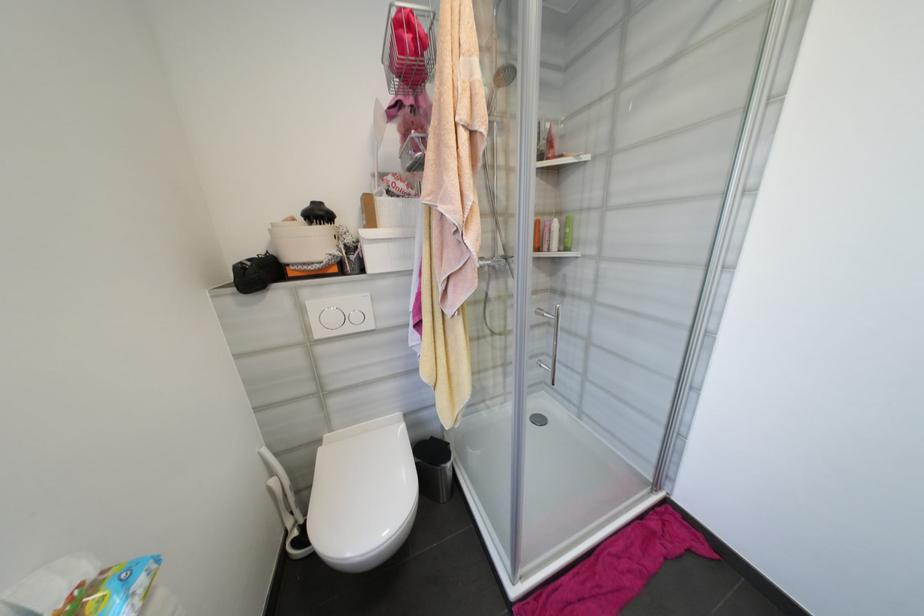
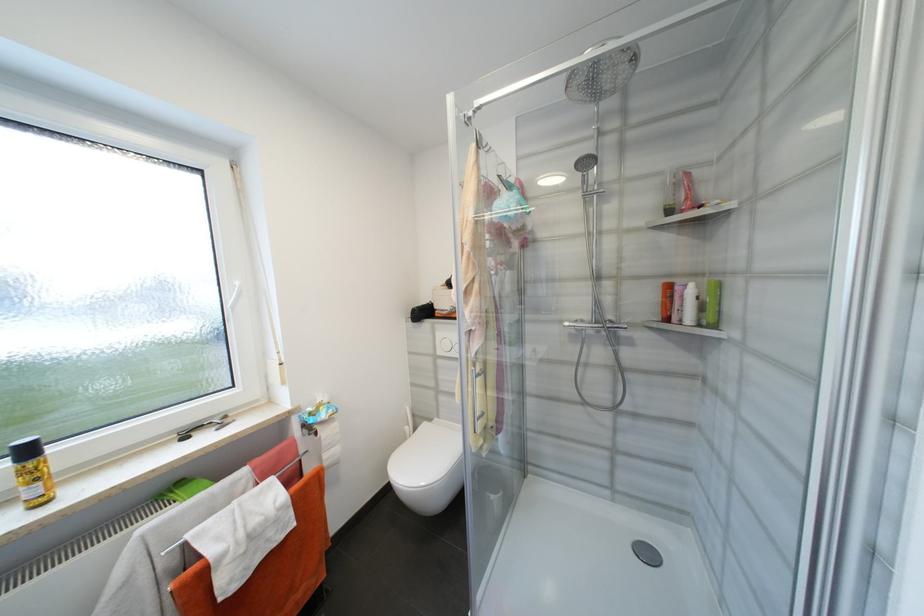
Where in the second image is the point corresponding to point (324, 334) from the first image?

(445, 353)